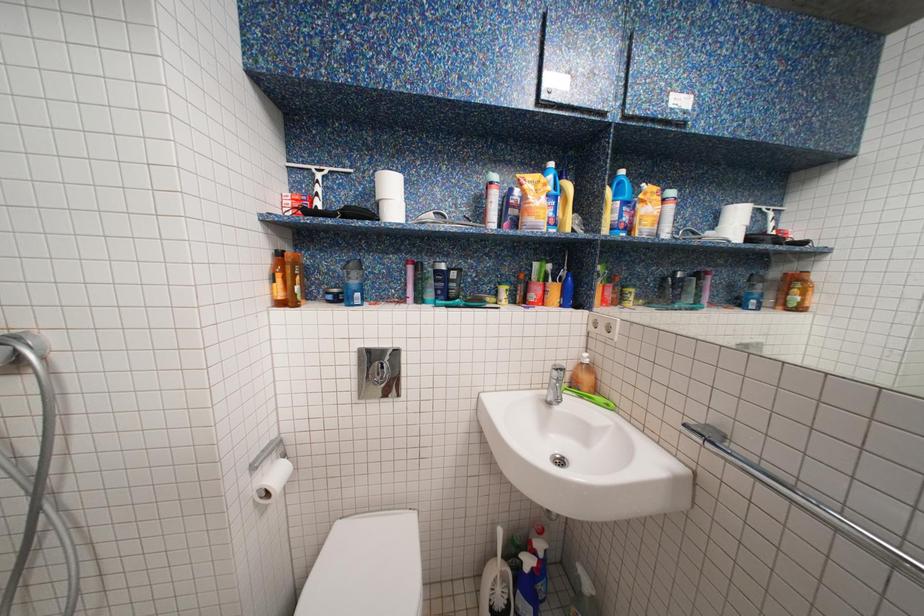
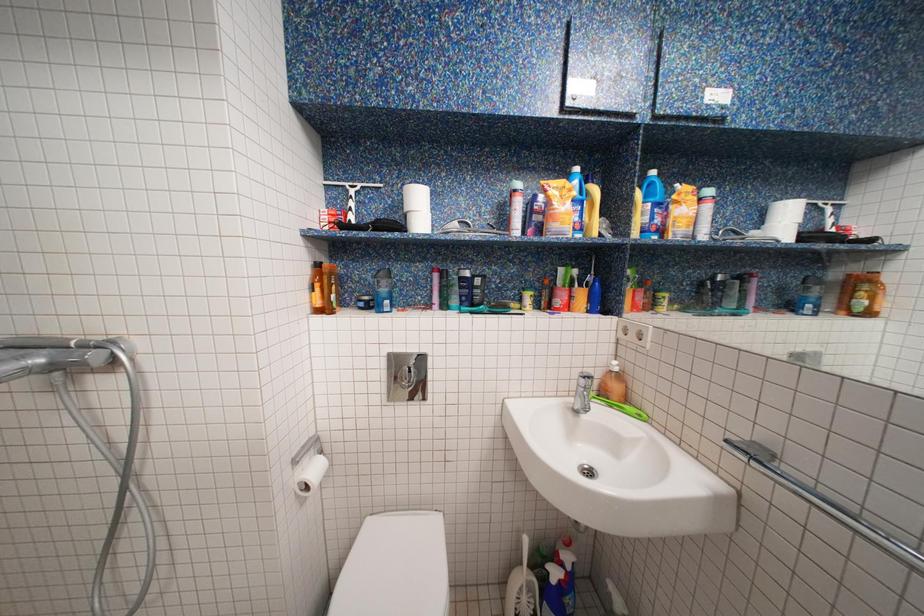
Question: The camera is either moving clockwise (left) or counter-clockwise (right) around the object. The first image is from the beginning of the video and the second image is from the end. Is the camera moving left or right when shooting the video?

Choices:
 (A) Left
 (B) Right

Answer: (B)